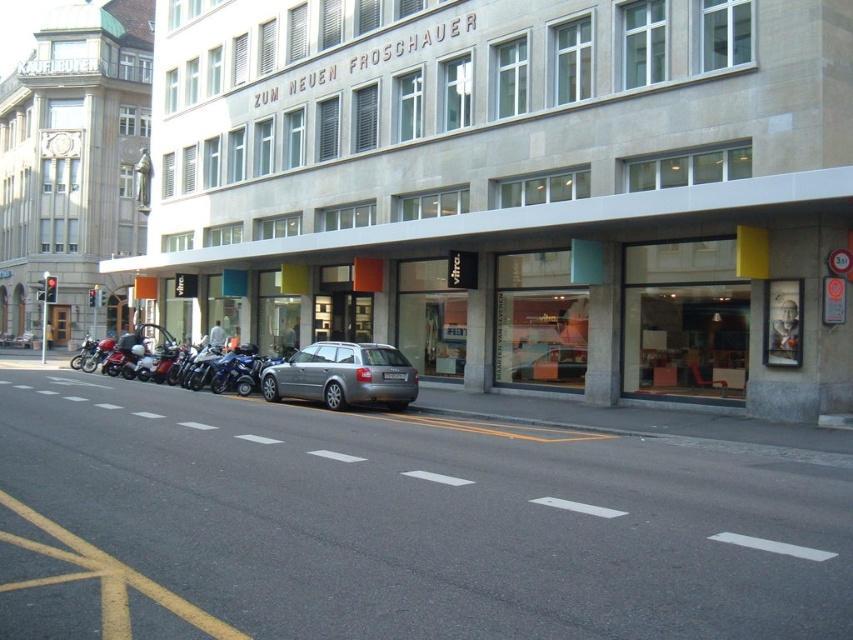
You are standing on the sidewalk in front of the building and see both the silver metallic car at center and the silver metallic station wagon at center. Which vehicle is closer to you?

The silver metallic car at center is closer to the viewer than the silver metallic station wagon at center.

You are a delivery person who needs to park a delivery van that is 1.8 meters tall. You see a silver metallic car at center and a silver metallic station wagon at center. Can you park your van between them without hitting the roof?

The silver metallic car at center is taller than the silver metallic station wagon at center. Since the car is taller than the van, there should be enough vertical space between them to park the van without hitting the roof.

You are standing at the entrance of the building and see a silver metallic car at center. There is a pedestrian crossing 50 feet ahead. Can you safely cross the street before the silver metallic car reaches the pedestrian crossing?

The silver metallic car at center is 44.51 feet away from you. Since the pedestrian crossing is 50 feet ahead, you can safely cross the street before the silver metallic car reaches the pedestrian crossing as the distance to the car is less than the distance to the crossing.